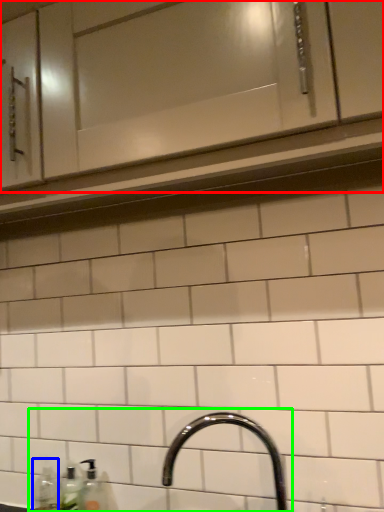
Question: Considering the real-world distances, which object is farthest from cabinetry (highlighted by a red box)? bottle (highlighted by a blue box) or sink (highlighted by a green box)?

Choices:
 (A) bottle
 (B) sink

Answer: (A)